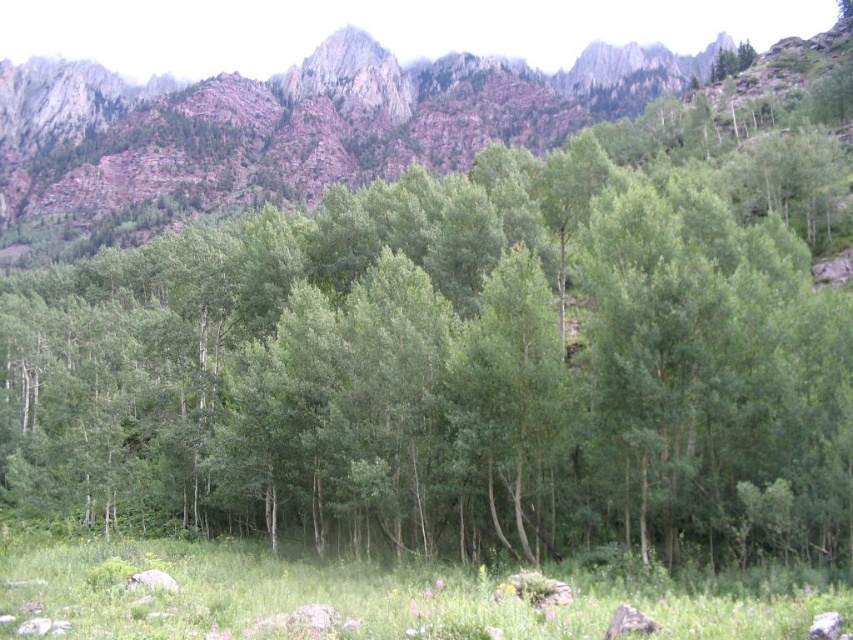
Question: Which object is farther from the camera taking this photo?

Choices:
 (A) rustic rock mountain at upper center
 (B) green grassy field at lower center

Answer: (A)

Question: Is rustic rock mountain at upper center closer to the viewer compared to green grassy field at lower center?

Choices:
 (A) no
 (B) yes

Answer: (A)

Question: Does rustic rock mountain at upper center come in front of green grassy field at lower center?

Choices:
 (A) yes
 (B) no

Answer: (B)

Question: Among these points, which one is nearest to the camera?

Choices:
 (A) (103, 77)
 (B) (778, 624)

Answer: (B)

Question: Considering the relative positions of rustic rock mountain at upper center and green grassy field at lower center in the image provided, where is rustic rock mountain at upper center located with respect to green grassy field at lower center?

Choices:
 (A) below
 (B) above

Answer: (B)